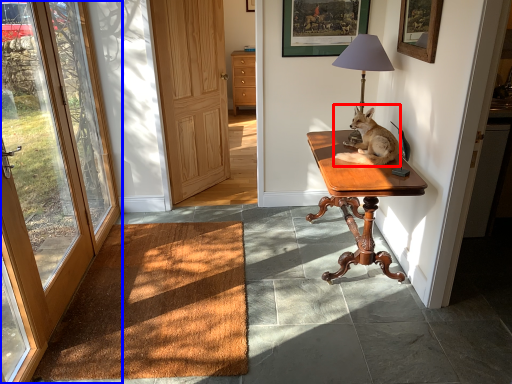
Question: Among these objects, which one is nearest to the camera, dog (highlighted by a red box) or door (highlighted by a blue box)?

Choices:
 (A) dog
 (B) door

Answer: (B)